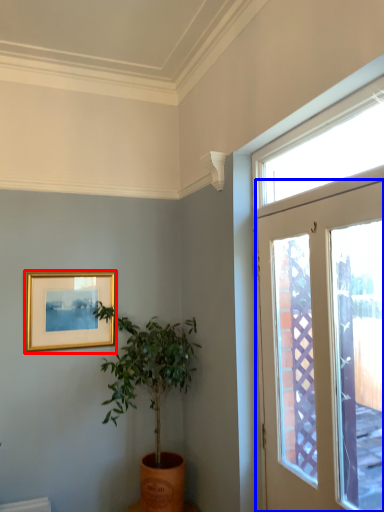
Question: Which object is further to the camera taking this photo, picture frame (highlighted by a red box) or door (highlighted by a blue box)?

Choices:
 (A) picture frame
 (B) door

Answer: (A)